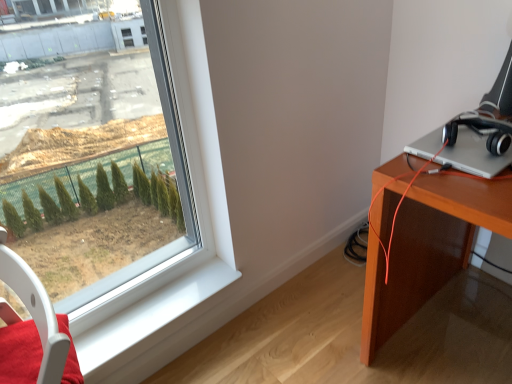
Identify the location of free space in front of clear glass window at left. This screenshot has width=512, height=384. (130, 326).